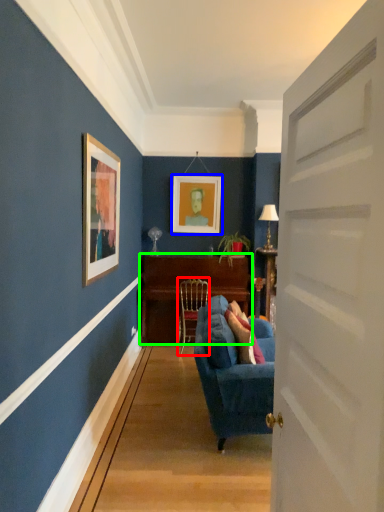
Question: Considering the real-world distances, which object is closest to chair (highlighted by a red box)? picture frame (highlighted by a blue box) or table (highlighted by a green box).

Choices:
 (A) picture frame
 (B) table

Answer: (B)